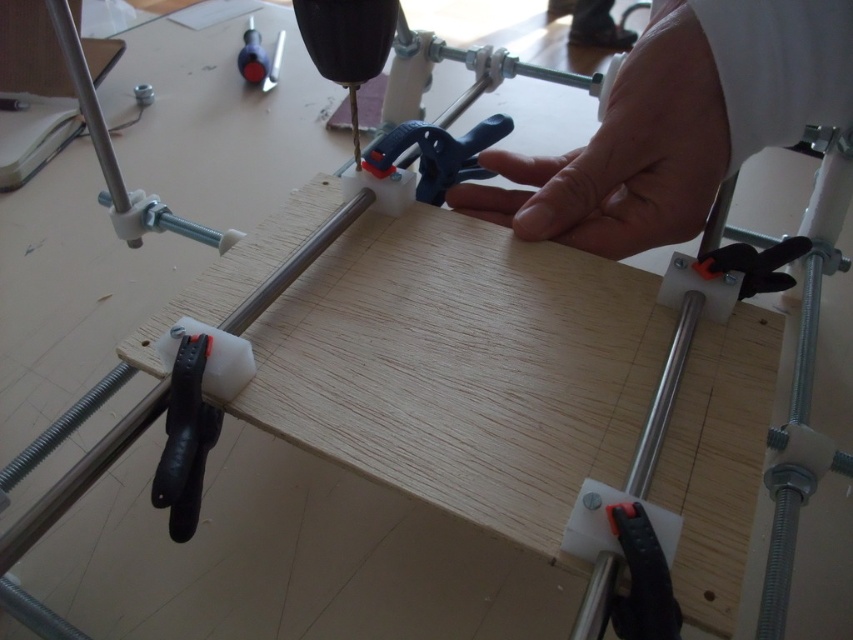
You are a carpenter who needs to reach the blue plastic clamp at center while holding a tool in your skinny white hand at center. Can you comfortably grab the clamp without moving your hand more than 5 inches?

The distance between the skinny white hand at center and the blue plastic clamp at center is 4.90 inches, which is just under 5 inches. Therefore, you can comfortably grab the clamp without moving your hand more than 5 inches.

In the woodworking scene, you notice a skinny white hand at center and a matte plastic screwdriver at upper left. From the perspective of someone looking at the image, which object is positioned to the left?

The matte plastic screwdriver at upper left is positioned to the left of the skinny white hand at center.

Consider the image. You are a person trying to reach the point at coordinates (625, 156) in the woodworking scene. Based on the description, can you determine if your hand is already at that point?

Yes, the point at (625, 156) is on the skinny white hand at center, so your hand is already at that point.